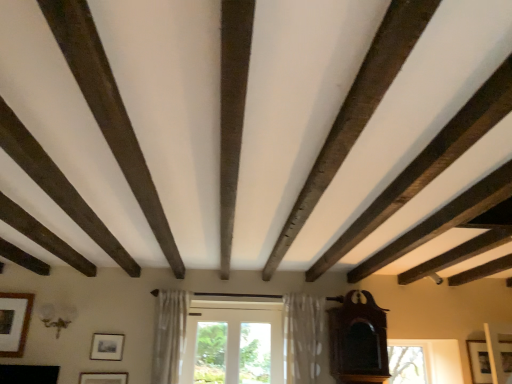
Measure the distance between point (361,326) and camera.

Point (361,326) is 3.67 meters away from camera.

From the picture: In order to face matte black picture frame at center, the second picture frame viewed from the left, should I rotate leftwards or rightwards?

To align with it, rotate left about 19.182°.

Describe the element at coordinates (103, 378) in the screenshot. I see `matte gold picture frame at lower center, the 2th picture frame from the right` at that location.

How much space does wooden picture frame at lower right, which is the fourth picture frame in left-to-right order, occupy vertically?

It is 39.41 centimeters.

From the picture: What is the approximate height of clear glass window at lower right?

It is 16.06 inches.

Find the location of a particular element. The height and width of the screenshot is (384, 512). wooden picture frame at lower left, which is the first picture frame in left-to-right order is located at coordinates (14, 322).

From the image's perspective, between matte gold picture frame at lower center, the 2th picture frame from the right, and mahogany wood grandfather clock at right, who is located below?

matte gold picture frame at lower center, the 2th picture frame from the right, appears lower in the image.

Is matte gold picture frame at lower center, which ranks as the third picture frame in left-to-right order, directly adjacent to mahogany wood grandfather clock at right?

matte gold picture frame at lower center, which ranks as the third picture frame in left-to-right order, and mahogany wood grandfather clock at right are clearly separated.

Does matte gold picture frame at lower center, the 2th picture frame from the right, have a larger size compared to mahogany wood grandfather clock at right?

No.

From a real-world perspective, which object rests below the other?

In real-world perspective, matte gold picture frame at lower center, which ranks as the third picture frame in left-to-right order, is lower.

Can you confirm if matte gold picture frame at lower center, which ranks as the third picture frame in left-to-right order, is wider than clear glass window at lower right?

In fact, matte gold picture frame at lower center, which ranks as the third picture frame in left-to-right order, might be narrower than clear glass window at lower right.

Does matte gold picture frame at lower center, which ranks as the third picture frame in left-to-right order, have a greater height compared to clear glass window at lower right?

No.

Are matte gold picture frame at lower center, which ranks as the third picture frame in left-to-right order, and clear glass window at lower right beside each other?

They are not placed beside each other.

From a real-world perspective, is matte gold picture frame at lower center, which ranks as the third picture frame in left-to-right order, located higher than clear glass window at lower right?

No.

Is point (3, 308) positioned in front of point (83, 379)?

That is False.

How different are the orientations of wooden picture frame at lower left, which is the first picture frame in left-to-right order, and matte gold picture frame at lower center, which ranks as the third picture frame in left-to-right order, in degrees?

The angular difference between wooden picture frame at lower left, which is the first picture frame in left-to-right order, and matte gold picture frame at lower center, which ranks as the third picture frame in left-to-right order, is 0.0972 degrees.

From a real-world perspective, is wooden picture frame at lower left, which is the first picture frame in left-to-right order, over matte gold picture frame at lower center, the 2th picture frame from the right?

Yes.

Which object is further away from the camera taking this photo, wooden picture frame at lower left, which is the first picture frame in left-to-right order, or matte gold picture frame at lower center, which ranks as the third picture frame in left-to-right order?

Positioned behind is wooden picture frame at lower left, which is the first picture frame in left-to-right order.

Is matte black picture frame at center, marked as the third picture frame in a right-to-left arrangement, located within clear glass window at lower right?

No, matte black picture frame at center, marked as the third picture frame in a right-to-left arrangement, is not inside clear glass window at lower right.

From the image's perspective, between clear glass window at lower right and matte black picture frame at center, the second picture frame viewed from the left, who is located below?

clear glass window at lower right is shown below in the image.

Are clear glass window at lower right and matte black picture frame at center, marked as the third picture frame in a right-to-left arrangement, far apart?

Absolutely, clear glass window at lower right is distant from matte black picture frame at center, marked as the third picture frame in a right-to-left arrangement.

Consider the image. Considering the sizes of objects clear glass window at lower right and matte black picture frame at center, marked as the third picture frame in a right-to-left arrangement, in the image provided, who is taller, clear glass window at lower right or matte black picture frame at center, marked as the third picture frame in a right-to-left arrangement,?

clear glass window at lower right is taller.

Locate an element on the screen. curtain below the white sheer curtain at center, which is the 1th curtain from right to left (from a real-world perspective) is located at coordinates (169, 334).

From a real-world perspective, is sheer white curtain at center, marked as the first curtain in a left-to-right arrangement, above or below white sheer curtain at center, which is counted as the second curtain, starting from the left?

sheer white curtain at center, marked as the first curtain in a left-to-right arrangement, is below white sheer curtain at center, which is counted as the second curtain, starting from the left.

Is white sheer curtain at center, which is the 1th curtain from right to left, a part of sheer white curtain at center, which ranks as the 2th curtain in right-to-left order?

No, sheer white curtain at center, which ranks as the 2th curtain in right-to-left order, does not contain white sheer curtain at center, which is the 1th curtain from right to left.

What's the angular difference between mahogany wood grandfather clock at right and matte gold picture frame at lower center, which ranks as the third picture frame in left-to-right order,'s facing directions?

They differ by 1.86 degrees in their facing directions.

From a real-world perspective, who is located higher, mahogany wood grandfather clock at right or matte gold picture frame at lower center, the 2th picture frame from the right?

mahogany wood grandfather clock at right is physically above.

Can you confirm if mahogany wood grandfather clock at right is positioned to the right of matte gold picture frame at lower center, the 2th picture frame from the right?

Correct, you'll find mahogany wood grandfather clock at right to the right of matte gold picture frame at lower center, the 2th picture frame from the right.

Which of these two, mahogany wood grandfather clock at right or matte gold picture frame at lower center, which ranks as the third picture frame in left-to-right order, is bigger?

mahogany wood grandfather clock at right is bigger.

From the image's perspective, would you say white sheer curtain at center, which is counted as the second curtain, starting from the left, is shown under wooden picture frame at lower left, which is the first picture frame in left-to-right order?

Correct, white sheer curtain at center, which is counted as the second curtain, starting from the left, appears lower than wooden picture frame at lower left, which is the first picture frame in left-to-right order, in the image.

Can you confirm if white sheer curtain at center, which is the 1th curtain from right to left, is taller than wooden picture frame at lower left, which is the first picture frame in left-to-right order?

Indeed, white sheer curtain at center, which is the 1th curtain from right to left, has a greater height compared to wooden picture frame at lower left, which is the first picture frame in left-to-right order.

From a real-world perspective, is white sheer curtain at center, which is counted as the second curtain, starting from the left, positioned over wooden picture frame at lower left, which is the first picture frame in left-to-right order, based on gravity?

Actually, white sheer curtain at center, which is counted as the second curtain, starting from the left, is physically below wooden picture frame at lower left, which is the first picture frame in left-to-right order, in the real world.

From the wooden picture frame at lower left, which is the first picture frame in left-to-right order, count 1st curtains forward and point to it. Please provide its 2D coordinates.

[(302, 337)]

Locate an element on the screen. Image resolution: width=512 pixels, height=384 pixels. furniture above the matte gold picture frame at lower center, which ranks as the third picture frame in left-to-right order (from a real-world perspective) is located at coordinates (358, 341).

Where is `picture frame that is the 1st object to the left of the clear glass window at lower right, starting at the anchor`? picture frame that is the 1st object to the left of the clear glass window at lower right, starting at the anchor is located at coordinates (103, 378).

Looking at the image, which one is located further to clear glass window at lower right, wooden picture frame at lower left, which is the first picture frame in left-to-right order, or sheer white curtain at center, marked as the first curtain in a left-to-right arrangement?

Among the two, wooden picture frame at lower left, which is the first picture frame in left-to-right order, is located further to clear glass window at lower right.

From the image, which object appears to be farther from sheer white curtain at center, which ranks as the 2th curtain in right-to-left order, mahogany wood grandfather clock at right or matte black picture frame at center, marked as the third picture frame in a right-to-left arrangement?

The object further to sheer white curtain at center, which ranks as the 2th curtain in right-to-left order, is mahogany wood grandfather clock at right.

Estimate the real-world distances between objects in this image. Which object is closer to matte black picture frame at center, marked as the third picture frame in a right-to-left arrangement, wooden picture frame at lower left, which is the first picture frame in left-to-right order, or mahogany wood grandfather clock at right?

wooden picture frame at lower left, which is the first picture frame in left-to-right order, lies closer to matte black picture frame at center, marked as the third picture frame in a right-to-left arrangement, than the other object.

From the image, which object appears to be farther from mahogany wood grandfather clock at right, sheer white curtain at center, which ranks as the 2th curtain in right-to-left order, or clear glass window at lower right?

sheer white curtain at center, which ranks as the 2th curtain in right-to-left order, is positioned further to the anchor mahogany wood grandfather clock at right.

When comparing their distances from mahogany wood grandfather clock at right, does sheer white curtain at center, marked as the first curtain in a left-to-right arrangement, or matte gold picture frame at lower center, which ranks as the third picture frame in left-to-right order, seem closer?

sheer white curtain at center, marked as the first curtain in a left-to-right arrangement.

Based on their spatial positions, is sheer white curtain at center, marked as the first curtain in a left-to-right arrangement, or mahogany wood grandfather clock at right closer to matte black picture frame at center, marked as the third picture frame in a right-to-left arrangement?

A: sheer white curtain at center, marked as the first curtain in a left-to-right arrangement, is closer to matte black picture frame at center, marked as the third picture frame in a right-to-left arrangement.

When comparing their distances from wooden picture frame at lower left, which is the 4th picture frame in right-to-left order, does wooden picture frame at lower right, which appears as the first picture frame when viewed from the right, or mahogany wood grandfather clock at right seem closer?

mahogany wood grandfather clock at right is closer to wooden picture frame at lower left, which is the 4th picture frame in right-to-left order.

From the image, which object appears to be farther from wooden picture frame at lower left, which is the 4th picture frame in right-to-left order, matte black picture frame at center, marked as the third picture frame in a right-to-left arrangement, or wooden picture frame at lower right, which is the fourth picture frame in left-to-right order?

Based on the image, wooden picture frame at lower right, which is the fourth picture frame in left-to-right order, appears to be further to wooden picture frame at lower left, which is the 4th picture frame in right-to-left order.

The image size is (512, 384). In order to click on picture frame between matte black picture frame at center, the second picture frame viewed from the left, and clear glass window at lower right, in the horizontal direction in this screenshot , I will do `click(103, 378)`.

Find the location of a particular element. furniture located between white sheer curtain at center, which is counted as the second curtain, starting from the left, and wooden picture frame at lower right, which is the fourth picture frame in left-to-right order, in the left-right direction is located at coordinates (358, 341).

Where is `window between white sheer curtain at center, which is counted as the second curtain, starting from the left, and wooden picture frame at lower right, which is the fourth picture frame in left-to-right order, in the horizontal direction`? Image resolution: width=512 pixels, height=384 pixels. window between white sheer curtain at center, which is counted as the second curtain, starting from the left, and wooden picture frame at lower right, which is the fourth picture frame in left-to-right order, in the horizontal direction is located at coordinates (406, 364).

The image size is (512, 384). I want to click on picture frame between wooden picture frame at lower left, which is the first picture frame in left-to-right order, and matte gold picture frame at lower center, the 2th picture frame from the right, from left to right, so click(106, 347).